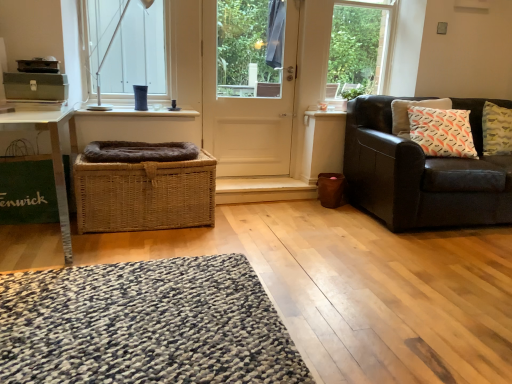
Locate an element on the screen. white glossy window sill at upper center is located at coordinates tap(139, 112).

Measure the distance between white glass window at upper left and camera.

white glass window at upper left is 9.57 feet away from camera.

Locate an element on the screen. This screenshot has height=384, width=512. white wood window frame at upper center is located at coordinates (360, 45).

What do you see at coordinates (145, 194) in the screenshot? I see `woven brown basket at center` at bounding box center [145, 194].

This screenshot has width=512, height=384. Find the location of `dark brown leather couch at right`. dark brown leather couch at right is located at coordinates (422, 172).

Is dark brown leather couch at right outside of white matte door at center?

Yes, dark brown leather couch at right is not within white matte door at center.

Who is smaller, dark brown leather couch at right or white matte door at center?

white matte door at center is smaller.

Considering the relative sizes of dark brown leather couch at right and white matte door at center in the image provided, is dark brown leather couch at right shorter than white matte door at center?

Yes, dark brown leather couch at right is shorter than white matte door at center.

Can you confirm if woven brown basket at center is positioned to the right of white glossy window sill at upper center?

Correct, you'll find woven brown basket at center to the right of white glossy window sill at upper center.

From the image's perspective, who appears lower, woven brown basket at center or white glossy window sill at upper center?

woven brown basket at center, from the image's perspective.

Can you tell me how much woven brown basket at center and white glossy window sill at upper center differ in facing direction?

woven brown basket at center and white glossy window sill at upper center are facing 1.03 degrees away from each other.

Is woven brown basket at center outside of white glossy window sill at upper center?

woven brown basket at center lies outside white glossy window sill at upper center's area.

I want to click on window below the white wood window frame at upper center (from the image's perspective), so click(x=127, y=46).

Between white glass window at upper left and white wood window frame at upper center, which one has smaller size?

white wood window frame at upper center.

Is white glass window at upper left further to camera compared to white wood window frame at upper center?

No, white glass window at upper left is closer to the viewer.

Which of these two, white glass window at upper left or white wood window frame at upper center, stands taller?

With more height is white wood window frame at upper center.

Can you confirm if textured gray mat at lower left is shorter than white glossy window sill at upper center?

Yes, textured gray mat at lower left is shorter than white glossy window sill at upper center.

Who is more distant, textured gray mat at lower left or white glossy window sill at upper center?

white glossy window sill at upper center is more distant.

Between woven brown basket at center and white matte door at center, which one is positioned behind?

Positioned behind is white matte door at center.

Is white matte door at center completely or partially inside woven brown basket at center?

No, white matte door at center is located outside of woven brown basket at center.

Which of these two, woven brown basket at center or white matte door at center, is smaller?

With smaller size is white matte door at center.

Looking at this image, in terms of width, does woven brown basket at center look wider or thinner when compared to white matte door at center?

In the image, woven brown basket at center appears to be wider than white matte door at center.

Consider the image. Can you tell me how much textured gray mat at lower left and dark brown leather couch at right differ in facing direction?

The facing directions of textured gray mat at lower left and dark brown leather couch at right are 1.37 degrees apart.

This screenshot has width=512, height=384. What are the coordinates of `studio couch above the textured gray mat at lower left (from a real-world perspective)` in the screenshot? It's located at (422, 172).

Is textured gray mat at lower left facing towards dark brown leather couch at right?

No.

From the picture: Is textured gray mat at lower left behind dark brown leather couch at right?

No, textured gray mat at lower left is closer to the viewer.

Is dark brown leather couch at right to the left or to the right of woven brown basket at center in the image?

dark brown leather couch at right is positioned on woven brown basket at center's right side.

Between dark brown leather couch at right and woven brown basket at center, which one has larger width?

dark brown leather couch at right is wider.

From a real-world perspective, does dark brown leather couch at right stand above woven brown basket at center?

Indeed, from a real-world perspective, dark brown leather couch at right stands above woven brown basket at center.

Where is `door that appears above the dark brown leather couch at right (from the image's perspective)`? The width and height of the screenshot is (512, 384). door that appears above the dark brown leather couch at right (from the image's perspective) is located at coordinates (249, 84).

Identify the location of crate below the white glossy window sill at upper center (from the image's perspective). Image resolution: width=512 pixels, height=384 pixels. (145, 194).

From the image, which object appears to be farther from dark brown leather couch at right, woven brown basket at center or white glass window at upper left?

white glass window at upper left is further to dark brown leather couch at right.

Considering their positions, is white wood window frame at upper center positioned closer to metallic silver table at lower left than white glossy window sill at upper center?

white glossy window sill at upper center is closer to metallic silver table at lower left.

Considering their positions, is white glossy window sill at upper center positioned closer to white glass window at upper left than white matte door at center?

white glossy window sill at upper center is closer to white glass window at upper left.

From the image, which object appears to be farther from textured gray mat at lower left, white glass window at upper left or woven brown basket at center?

white glass window at upper left is positioned further to the anchor textured gray mat at lower left.

Estimate the real-world distances between objects in this image. Which object is further from white wood window frame at upper center, white glass window at upper left or white matte door at center?

white glass window at upper left.

Looking at the image, which one is located closer to white glossy window sill at upper center, textured gray mat at lower left or white matte door at center?

white matte door at center lies closer to white glossy window sill at upper center than the other object.

Consider the image. From the image, which object appears to be nearer to dark brown leather couch at right, textured gray mat at lower left or woven brown basket at center?

woven brown basket at center.

Based on their spatial positions, is white matte door at center or white wood window frame at upper center closer to white glass window at upper left?

white matte door at center is positioned closer to the anchor white glass window at upper left.

This screenshot has width=512, height=384. I want to click on door located between metallic silver table at lower left and dark brown leather couch at right in the left-right direction, so click(x=249, y=84).

The height and width of the screenshot is (384, 512). I want to click on door between woven brown basket at center and white wood window frame at upper center in the horizontal direction, so click(x=249, y=84).

This screenshot has width=512, height=384. Find the location of `table between white glass window at upper left and woven brown basket at center in the up-down direction`. table between white glass window at upper left and woven brown basket at center in the up-down direction is located at coordinates (54, 159).

Locate an element on the screen. The image size is (512, 384). window between metallic silver table at lower left and white wood window frame at upper center from left to right is located at coordinates (127, 46).